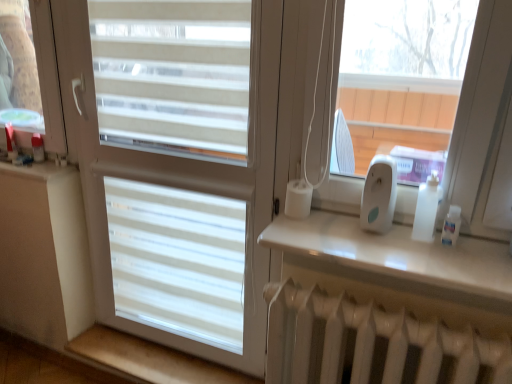
Question: Is white matte window at center far from beige wood at lower left, which is counted as the second window sill, starting from the front?

Choices:
 (A) no
 (B) yes

Answer: (A)

Question: Does white matte window at center have a lesser height compared to beige wood at lower left, which ranks as the 2th window sill in right-to-left order?

Choices:
 (A) yes
 (B) no

Answer: (B)

Question: From a real-world perspective, is white matte window at center over beige wood at lower left, arranged as the 1th window sill when viewed from the back?

Choices:
 (A) yes
 (B) no

Answer: (A)

Question: Can you confirm if white matte window at center is smaller than beige wood at lower left, which ranks as the 2th window sill in right-to-left order?

Choices:
 (A) no
 (B) yes

Answer: (A)

Question: Considering the relative positions of white matte window at center and beige wood at lower left, the first window sill ordered from the bottom, in the image provided, is white matte window at center to the right of beige wood at lower left, the first window sill ordered from the bottom, from the viewer's perspective?

Choices:
 (A) yes
 (B) no

Answer: (A)

Question: From the image's perspective, relative to beige wood at lower left, which is counted as the second window sill, starting from the front, is white plastic ipod at right above or below?

Choices:
 (A) above
 (B) below

Answer: (A)

Question: Is point (382, 190) positioned closer to the camera than point (75, 339)?

Choices:
 (A) closer
 (B) farther

Answer: (A)

Question: In terms of width, does white plastic ipod at right look wider or thinner when compared to beige wood at lower left, the second window sill from the top?

Choices:
 (A) wide
 (B) thin

Answer: (B)

Question: In the image, is white plastic ipod at right positioned in front of or behind beige wood at lower left, which is counted as the second window sill, starting from the front?

Choices:
 (A) front
 (B) behind

Answer: (A)

Question: Is beige wood at lower left, the 1th window sill when ordered from left to right, in front of or behind white plastic ipod at right in the image?

Choices:
 (A) behind
 (B) front

Answer: (A)

Question: Is point (159, 364) closer or farther from the camera than point (381, 228)?

Choices:
 (A) closer
 (B) farther

Answer: (B)

Question: In terms of width, does beige wood at lower left, which is counted as the second window sill, starting from the front, look wider or thinner when compared to white plastic ipod at right?

Choices:
 (A) wide
 (B) thin

Answer: (A)

Question: Based on their sizes in the image, would you say beige wood at lower left, the first window sill ordered from the bottom, is bigger or smaller than white plastic ipod at right?

Choices:
 (A) big
 (B) small

Answer: (A)

Question: Is beige wood at lower left, the first window sill ordered from the bottom, to the left or to the right of white matte window at center in the image?

Choices:
 (A) left
 (B) right

Answer: (A)

Question: Is beige wood at lower left, which is counted as the second window sill, starting from the front, taller or shorter than white matte window at center?

Choices:
 (A) short
 (B) tall

Answer: (A)